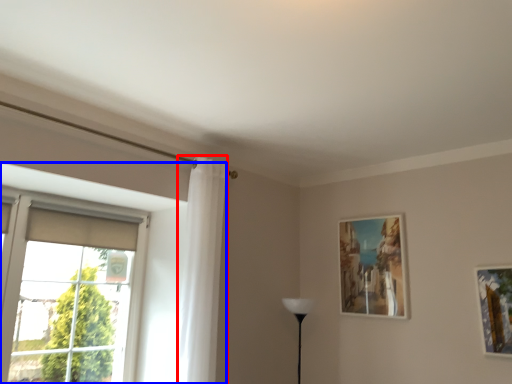
Question: Which point is further to the camera, curtain (highlighted by a red box) or window (highlighted by a blue box)?

Choices:
 (A) curtain
 (B) window

Answer: (A)